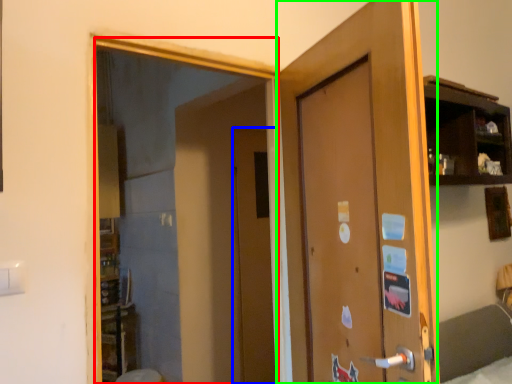
Question: Based on their relative distances, which object is farther from mirror (highlighted by a red box)? Choose from door (highlighted by a blue box) and door (highlighted by a green box).

Choices:
 (A) door
 (B) door

Answer: (B)